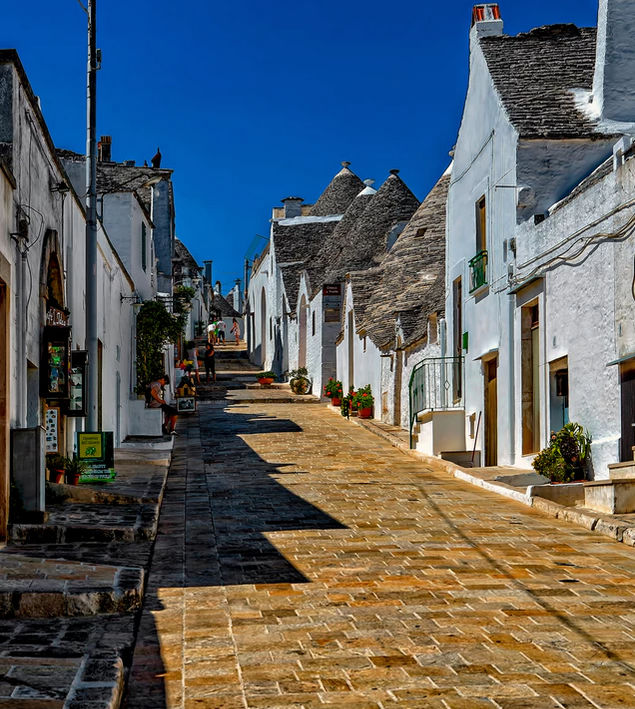
Locate an element on the screen. chimney is located at coordinates (104, 150).